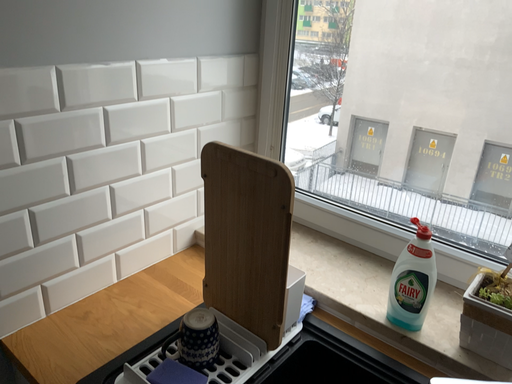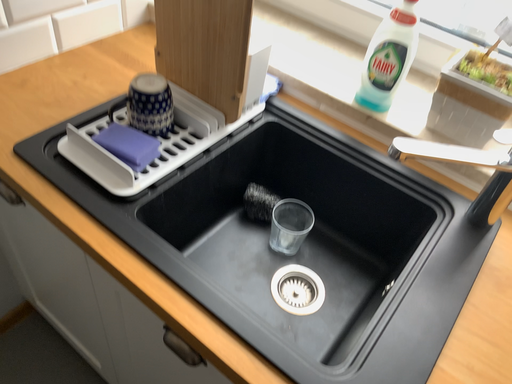
Question: Which way did the camera rotate in the video?

Choices:
 (A) rotated downward
 (B) rotated upward

Answer: (A)